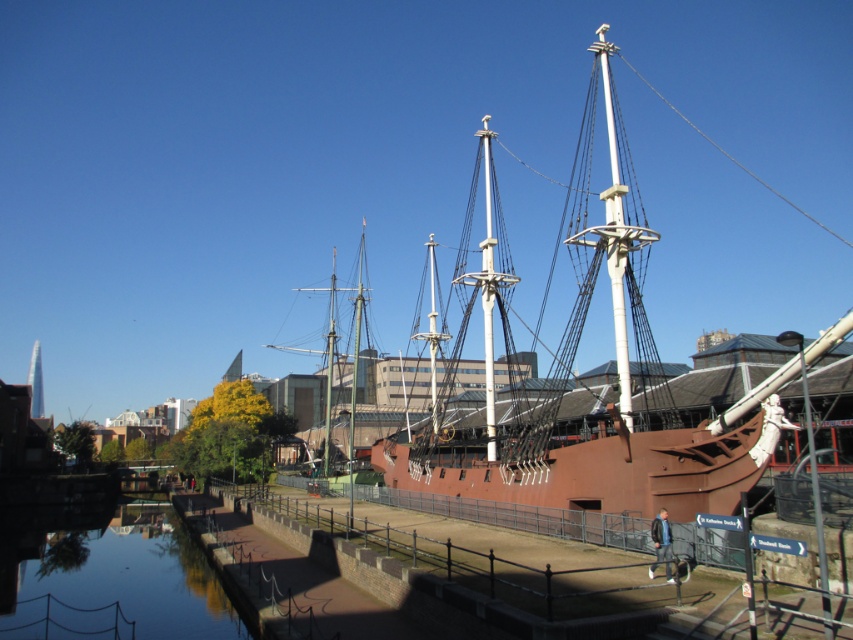
Question: Can you confirm if smooth water at lower left is positioned above rustic wood mast at center?

Choices:
 (A) no
 (B) yes

Answer: (A)

Question: Does smooth water at lower left appear under rustic wood mast at center?

Choices:
 (A) no
 (B) yes

Answer: (B)

Question: Based on their relative distances, which object is farther from the brown wooden ship at center?

Choices:
 (A) smooth water at lower left
 (B) rustic wood mast at center

Answer: (B)

Question: Among these objects, which one is nearest to the camera?

Choices:
 (A) brown wooden ship at center
 (B) rustic wood mast at center

Answer: (A)

Question: Which object appears farthest from the camera in this image?

Choices:
 (A) brown wooden ship at center
 (B) rustic wood mast at center

Answer: (B)

Question: Can you confirm if brown wooden ship at center is positioned to the left of smooth water at lower left?

Choices:
 (A) yes
 (B) no

Answer: (B)